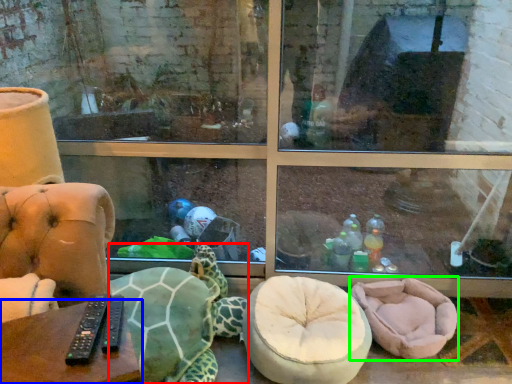
Question: Which object is positioned farthest from tortoise (highlighted by a red box)? Select from table (highlighted by a blue box) and bean bag chair (highlighted by a green box).

Choices:
 (A) table
 (B) bean bag chair

Answer: (A)